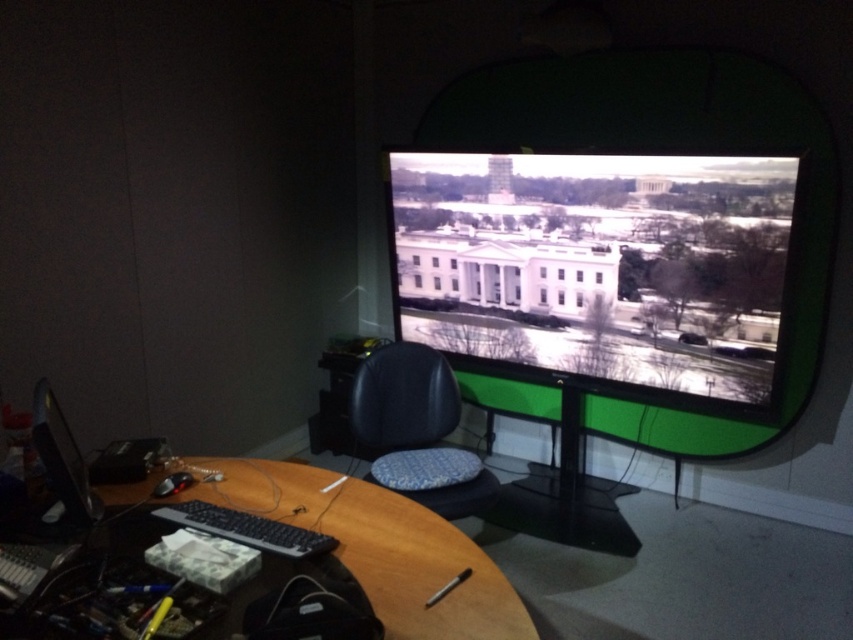
You are organizing items on the desk. You need to place a new item between the wooden at center and the matte black monitor at lower left. Where should you place it?

The wooden at center is positioned on the right side of matte black monitor at lower left, so placing the new item between them would require placing it to the right of the matte black monitor at lower left and to the left of the wooden at center.

You are standing at the entrance of the room and want to sit down in the black leather chair at center. Based on the coordinates provided, is the chair positioned closer to the desk or further away from it?

The black leather chair at center is located at point coordinates that place it closer to the desk since the coordinates suggest it is centrally positioned near the desk area.